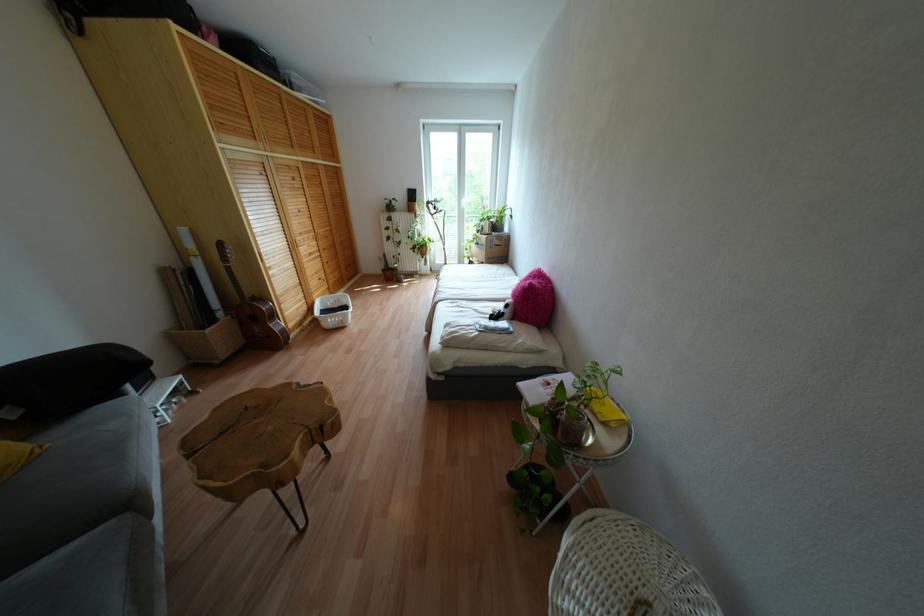
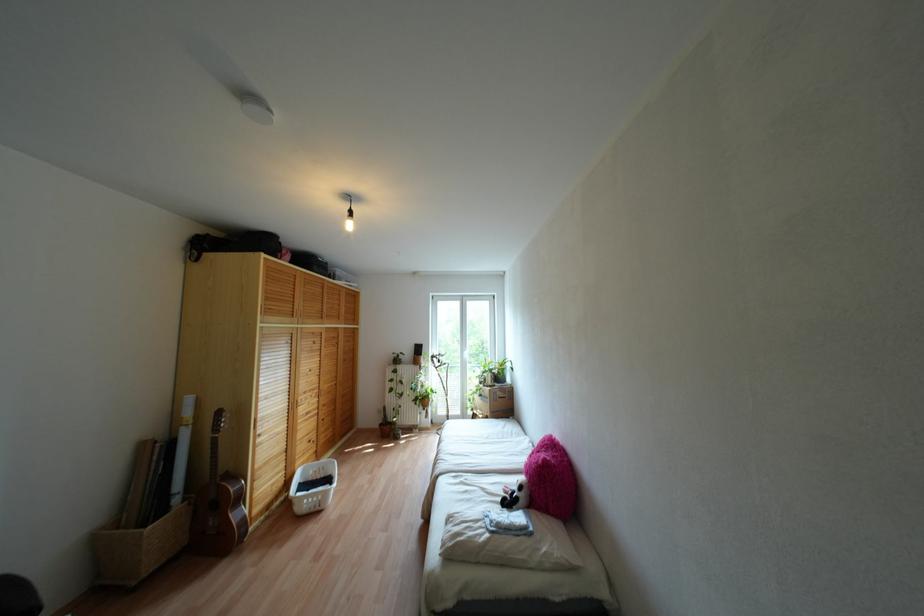
Locate, in the second image, the point that corresponds to (x=310, y=254) in the first image.

(307, 413)